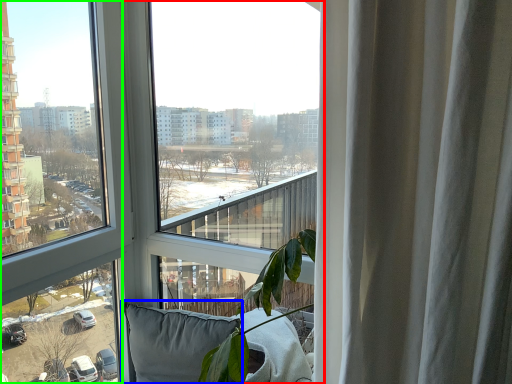
Question: Estimate the real-world distances between objects in this image. Which object is farther from window (highlighted by a red box), pillow (highlighted by a blue box) or window (highlighted by a green box)?

Choices:
 (A) pillow
 (B) window

Answer: (A)